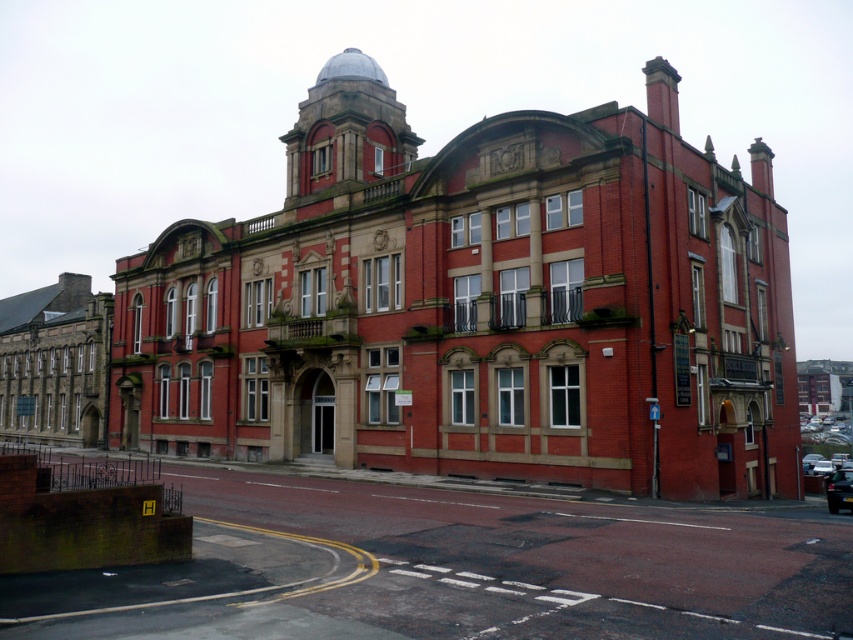
Between black glossy car at center and metallic silver car at center, which one appears on the left side from the viewer's perspective?

Positioned to the left is black glossy car at center.

Where is `black glossy car at center`? black glossy car at center is located at coordinates (839, 490).